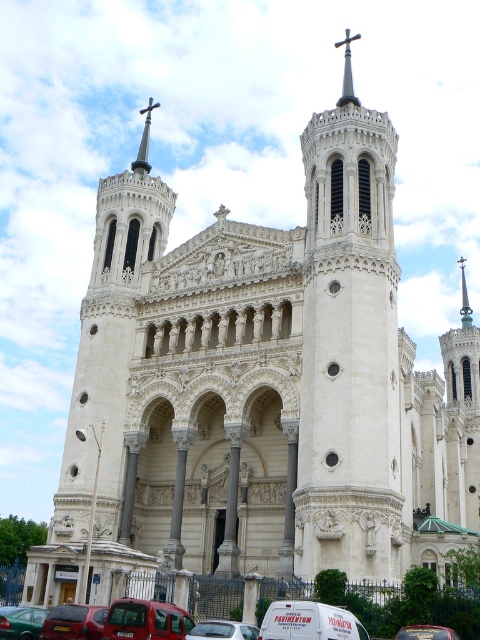
Question: Which object appears closest to the camera in this image?

Choices:
 (A) white glossy car at center
 (B) metallic silver van at center

Answer: (B)

Question: Can you confirm if green matte car at lower left is positioned above metallic silver van at center?

Choices:
 (A) no
 (B) yes

Answer: (A)

Question: Which point appears farthest from the camera in this image?

Choices:
 (A) (343, 88)
 (B) (422, 632)
 (C) (342, 198)

Answer: (A)

Question: Which point appears closest to the camera in this image?

Choices:
 (A) (241, 637)
 (B) (266, 624)
 (C) (409, 632)
 (D) (331, 540)

Answer: (B)

Question: Is white glossy car at center further to the viewer compared to polished silver cross at upper center?

Choices:
 (A) no
 (B) yes

Answer: (A)

Question: Can you confirm if white glossy car at center is thinner than polished silver cross at upper center?

Choices:
 (A) yes
 (B) no

Answer: (A)